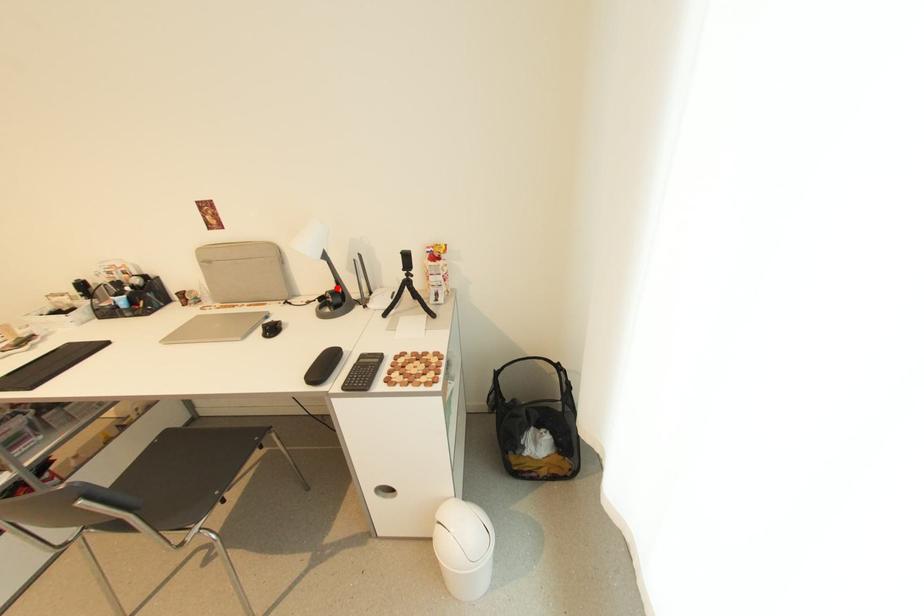
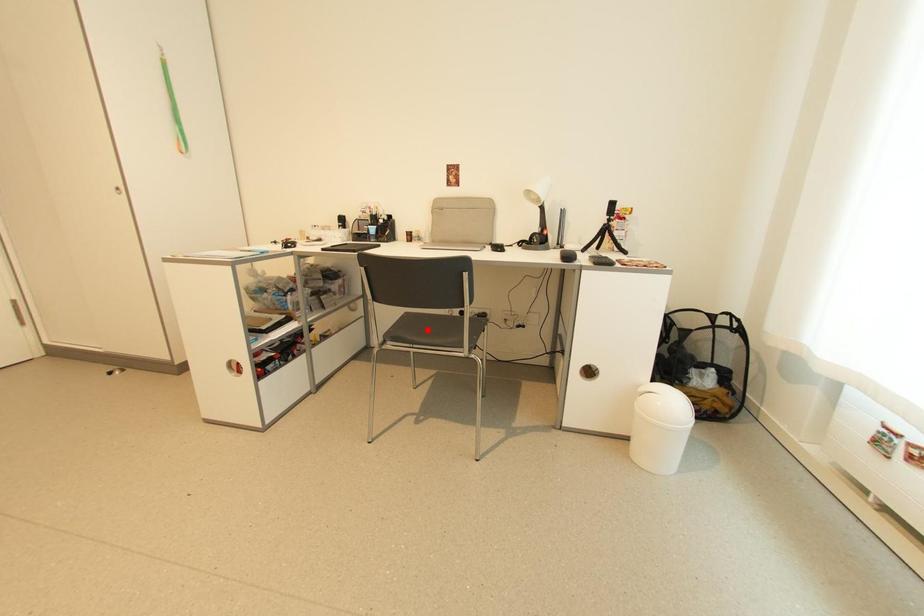
I am providing you with two images of the same scene from different viewpoints. A red point is marked on the first image and another point is marked on the second image. Does the point marked in image1 correspond to the same location as the one in image2?

No